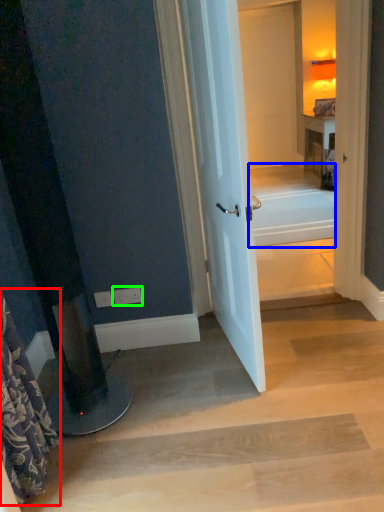
Question: Considering the real-world distances, which object is closest to shower curtain (highlighted by a red box)? bath (highlighted by a blue box) or electric outlet (highlighted by a green box).

Choices:
 (A) bath
 (B) electric outlet

Answer: (B)